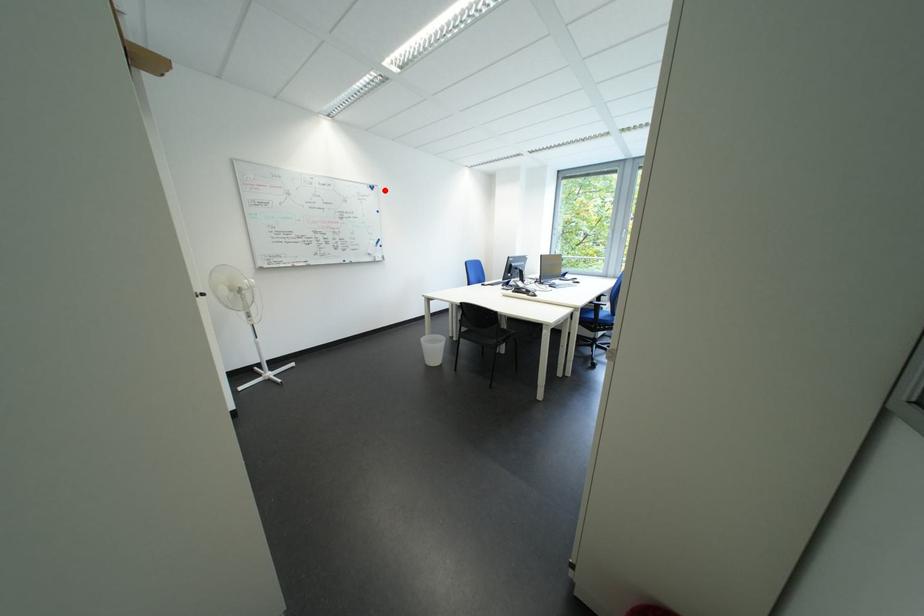
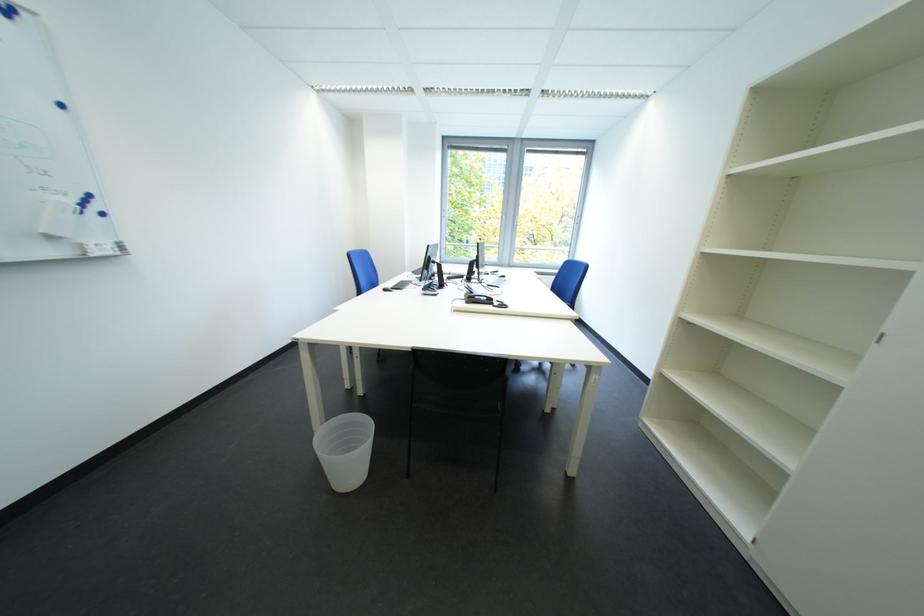
Locate, in the second image, the point that corresponds to the highlighted location in the first image.

(17, 12)